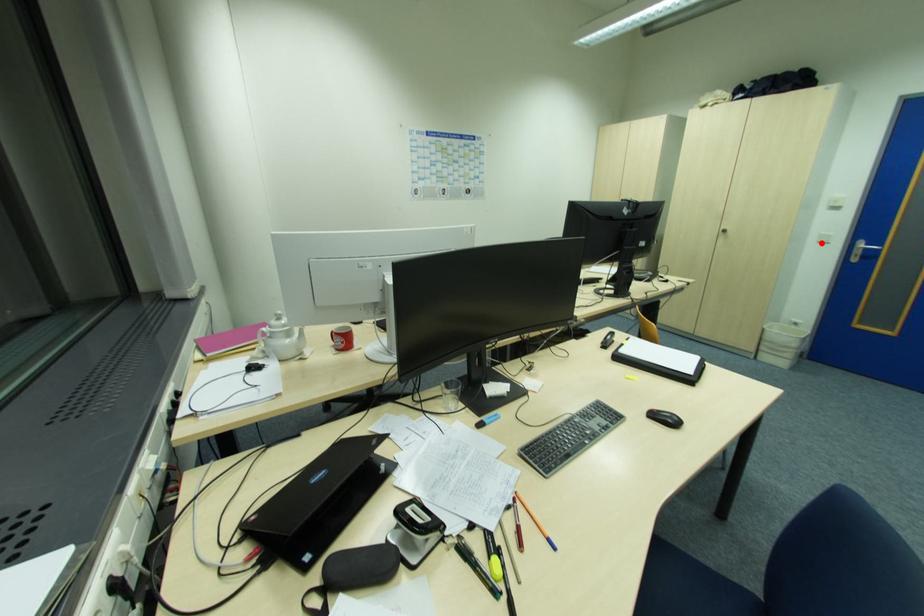
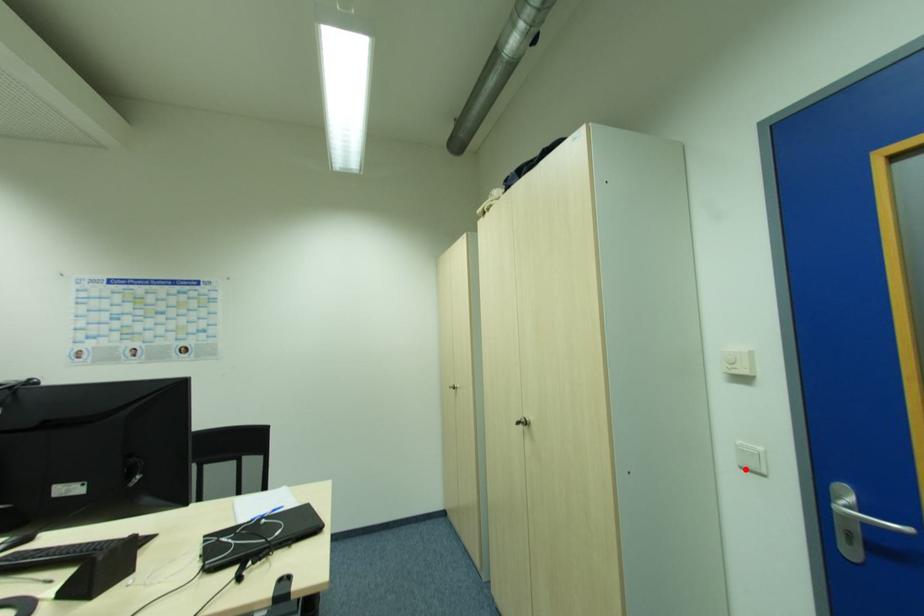
I am providing you with two images of the same scene from different viewpoints. A red point is marked on the first image and another point is marked on the second image. Does the point marked in image1 correspond to the same location as the one in image2?

Yes